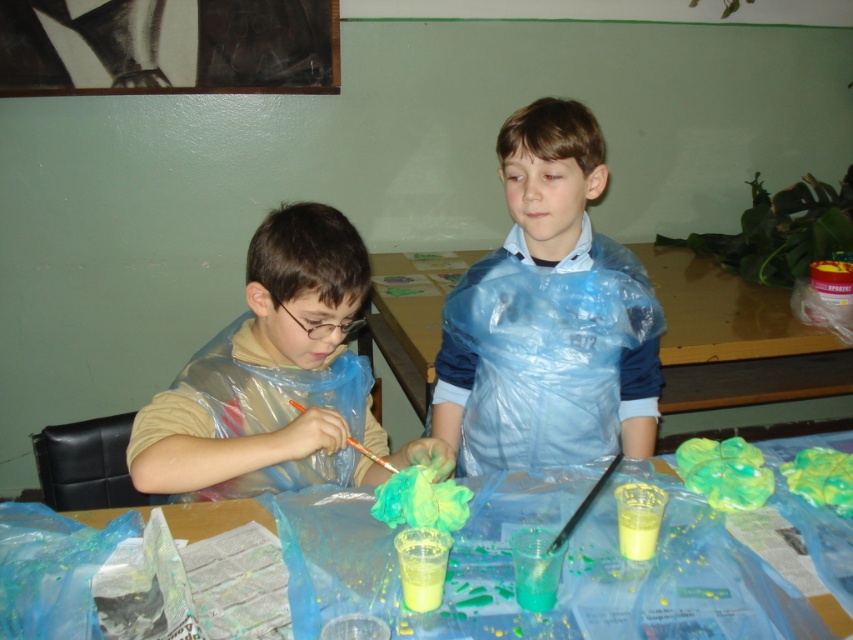
Consider the image. Can you confirm if translucent plastic table at center is taller than matte plastic apron at left?

Incorrect, translucent plastic table at center's height is not larger of matte plastic apron at left's.

Identify the location of translucent plastic table at center. The height and width of the screenshot is (640, 853). (560, 566).

Locate an element on the screen. This screenshot has height=640, width=853. translucent plastic table at center is located at coordinates (560, 566).

Between point (293, 540) and point (693, 380), which one is positioned in front?

Point (293, 540)

Can you confirm if translucent plastic table at center is bigger than wooden table at center?

No.

Find the location of a particular element. This screenshot has width=853, height=640. translucent plastic table at center is located at coordinates (560, 566).

Between translucent plastic table at center and blue plastic bag at center, which one appears on the right side from the viewer's perspective?

Positioned to the right is blue plastic bag at center.

Is point (595, 515) positioned before point (560, 100)?

That is True.

At what (x,y) coordinates should I click in order to perform the action: click on translucent plastic table at center. Please return your answer as a coordinate pair (x, y). Looking at the image, I should click on (560, 566).